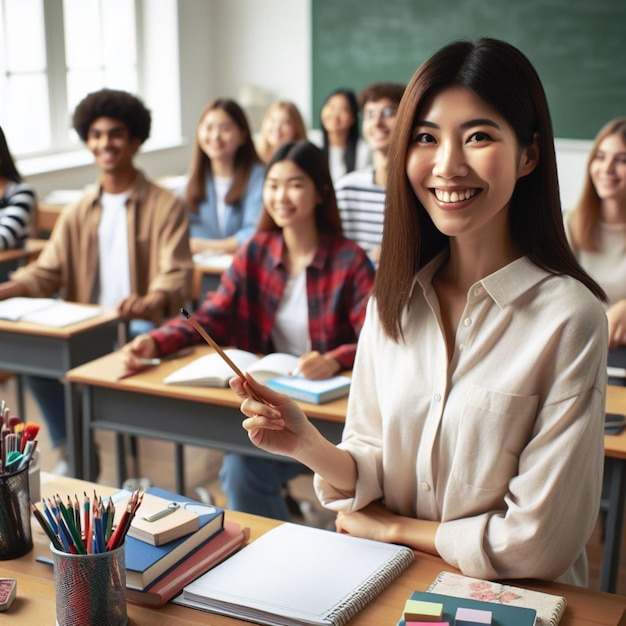
Please find pink post its in the image and show me where they are. Your answer should be formatted as a list of tuples, i.e. [(x1, y1), (x2, y2), ...], where each tuple contains the x and y coordinates of a point satisfying the conditions above.

[(436, 622)]